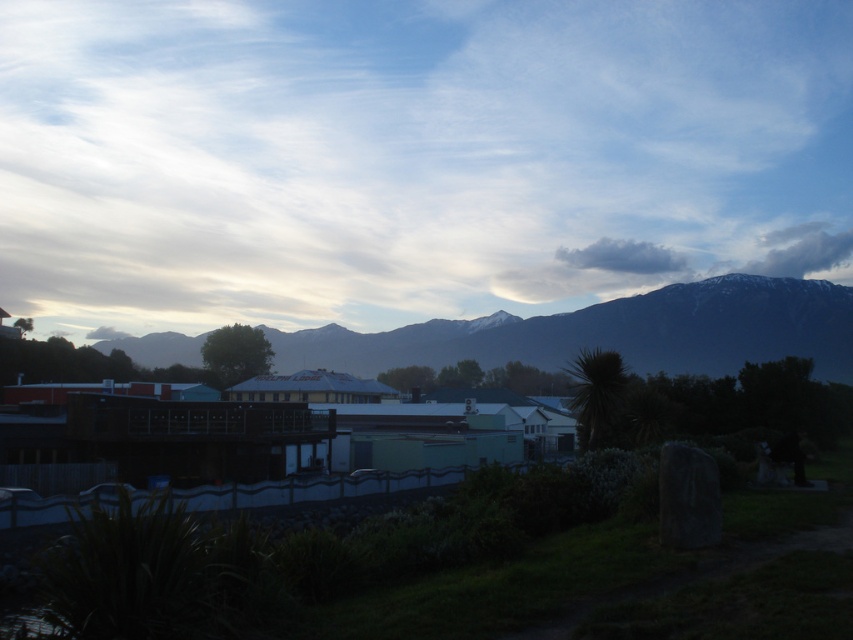
Question: Which object is farther from the camera taking this photo?

Choices:
 (A) snow-covered mountain range at upper center
 (B) gray fluffy cloud at upper center

Answer: (B)

Question: Does snow-covered mountain range at upper center appear on the left side of gray fluffy cloud at upper center?

Choices:
 (A) yes
 (B) no

Answer: (A)

Question: Is snow-covered mountain range at upper center positioned before gray fluffy cloud at upper center?

Choices:
 (A) no
 (B) yes

Answer: (B)

Question: Which point is closer to the camera taking this photo?

Choices:
 (A) (665, 362)
 (B) (677, 253)

Answer: (A)

Question: Can you confirm if snow-covered mountain range at upper center is positioned to the right of gray fluffy cloud at upper center?

Choices:
 (A) yes
 (B) no

Answer: (B)